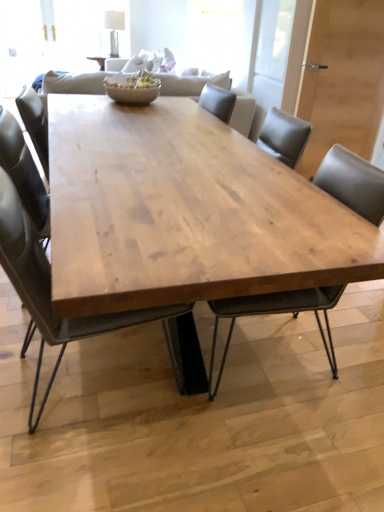
Locate an element on the screen. matte black chair at center, the first chair when ordered from left to right is located at coordinates (50, 289).

Locate an element on the screen. matte wood chair at center, which appears as the 2th chair when viewed from the left is located at coordinates (275, 313).

Considering the sizes of objects natural wood table at center and matte brown bowl at center in the image provided, who is taller, natural wood table at center or matte brown bowl at center?

natural wood table at center.

Considering the sizes of natural wood table at center and matte brown bowl at center in the image, is natural wood table at center bigger or smaller than matte brown bowl at center?

natural wood table at center is bigger than matte brown bowl at center.

Considering the positions of point (112, 113) and point (148, 98), is point (112, 113) closer or farther from the camera than point (148, 98)?

Clearly, point (112, 113) is closer to the camera than point (148, 98).

Choose the correct answer: Is natural wood table at center inside matte brown bowl at center or outside it?

The correct answer is: outside.

From the image's perspective, which is below, natural wood table at center or matte black chair at center, the first chair when ordered from left to right?

From the image's view, matte black chair at center, the first chair when ordered from left to right, is below.

Looking at this image, what's the angular difference between natural wood table at center and matte black chair at center, the second chair when ordered from right to left,'s facing directions?

The angle between the facing direction of natural wood table at center and the facing direction of matte black chair at center, the second chair when ordered from right to left, is 176 degrees.

Between natural wood table at center and matte black chair at center, the first chair when ordered from left to right, which one is positioned behind?

Positioned behind is matte black chair at center, the first chair when ordered from left to right.

Choose the correct answer: Is natural wood table at center inside matte black chair at center, the first chair when ordered from left to right, or outside it?

natural wood table at center is not inside matte black chair at center, the first chair when ordered from left to right, it's outside.

Does natural wood table at center touch matte wood chair at center, which appears as the 2th chair when viewed from the left?

No, natural wood table at center is not next to matte wood chair at center, which appears as the 2th chair when viewed from the left.

Looking at their sizes, would you say natural wood table at center is wider or thinner than matte wood chair at center, the 1th chair viewed from the right?

natural wood table at center is wider than matte wood chair at center, the 1th chair viewed from the right.

Does point (200, 296) appear closer or farther from the camera than point (295, 314)?

Point (200, 296).

Between matte wood chair at center, the 1th chair viewed from the right, and matte black chair at center, the first chair when ordered from left to right, which one appears on the right side from the viewer's perspective?

From the viewer's perspective, matte wood chair at center, the 1th chair viewed from the right, appears more on the right side.

In the scene shown: Would you consider matte wood chair at center, the 1th chair viewed from the right, to be distant from matte black chair at center, the second chair when ordered from right to left?

No, matte wood chair at center, the 1th chair viewed from the right, is in close proximity to matte black chair at center, the second chair when ordered from right to left.

Between point (332, 189) and point (55, 343), which one is positioned behind?

The point (332, 189) is more distant.

Considering the sizes of matte wood chair at center, the 1th chair viewed from the right, and matte black chair at center, the first chair when ordered from left to right, in the image, is matte wood chair at center, the 1th chair viewed from the right, wider or thinner than matte black chair at center, the first chair when ordered from left to right,?

Clearly, matte wood chair at center, the 1th chair viewed from the right, has more width compared to matte black chair at center, the first chair when ordered from left to right.

Is matte wood chair at center, which appears as the 2th chair when viewed from the left, oriented towards natural wood table at center?

Yes.

Which object is positioned more to the right, matte wood chair at center, which appears as the 2th chair when viewed from the left, or natural wood table at center?

matte wood chair at center, which appears as the 2th chair when viewed from the left.

Is matte wood chair at center, the 1th chair viewed from the right, thinner than natural wood table at center?

Yes.

Does matte wood chair at center, the 1th chair viewed from the right, touch natural wood table at center?

No, matte wood chair at center, the 1th chair viewed from the right, is not touching natural wood table at center.

From their relative heights in the image, would you say matte black chair at center, the first chair when ordered from left to right, is taller or shorter than matte brown bowl at center?

matte black chair at center, the first chair when ordered from left to right, is taller than matte brown bowl at center.

Is matte black chair at center, the second chair when ordered from right to left, at the right side of matte brown bowl at center?

Yes, matte black chair at center, the second chair when ordered from right to left, is to the right of matte brown bowl at center.

Does matte black chair at center, the first chair when ordered from left to right, have a greater width compared to matte brown bowl at center?

Indeed, matte black chair at center, the first chair when ordered from left to right, has a greater width compared to matte brown bowl at center.

Does point (51, 341) come in front of point (155, 82)?

Yes, it is in front of point (155, 82).

Can you confirm if matte black chair at center, the first chair when ordered from left to right, is shorter than matte wood chair at center, which appears as the 2th chair when viewed from the left?

Incorrect, the height of matte black chair at center, the first chair when ordered from left to right, does not fall short of that of matte wood chair at center, which appears as the 2th chair when viewed from the left.

Is matte black chair at center, the second chair when ordered from right to left, next to matte wood chair at center, which appears as the 2th chair when viewed from the left?

matte black chair at center, the second chair when ordered from right to left, and matte wood chair at center, which appears as the 2th chair when viewed from the left, are clearly separated.

Is matte black chair at center, the second chair when ordered from right to left, closer to camera compared to matte wood chair at center, which appears as the 2th chair when viewed from the left?

Yes, matte black chair at center, the second chair when ordered from right to left, is in front of matte wood chair at center, which appears as the 2th chair when viewed from the left.

Does matte black chair at center, the first chair when ordered from left to right, appear on the left side of matte wood chair at center, the 1th chair viewed from the right?

Correct, you'll find matte black chair at center, the first chair when ordered from left to right, to the left of matte wood chair at center, the 1th chair viewed from the right.

This screenshot has width=384, height=512. Identify the location of coffee table in front of the matte brown bowl at center. (185, 212).

What are the coordinates of `chair that is the 1st one when counting backward from the natural wood table at center` in the screenshot? It's located at (50, 289).

Based on their spatial positions, is matte brown bowl at center or natural wood table at center closer to matte wood chair at center, which appears as the 2th chair when viewed from the left?

Based on the image, natural wood table at center appears to be nearer to matte wood chair at center, which appears as the 2th chair when viewed from the left.

Considering their positions, is matte wood chair at center, the 1th chair viewed from the right, positioned further to matte black chair at center, the second chair when ordered from right to left, than matte brown bowl at center?

matte brown bowl at center.

Looking at this image, when comparing their distances from matte wood chair at center, which appears as the 2th chair when viewed from the left, does natural wood table at center or matte brown bowl at center seem closer?

natural wood table at center lies closer to matte wood chair at center, which appears as the 2th chair when viewed from the left, than the other object.

Estimate the real-world distances between objects in this image. Which object is further from matte wood chair at center, which appears as the 2th chair when viewed from the left, matte black chair at center, the first chair when ordered from left to right, or natural wood table at center?

natural wood table at center is positioned further to the anchor matte wood chair at center, which appears as the 2th chair when viewed from the left.

Based on their spatial positions, is matte brown bowl at center or natural wood table at center further from matte black chair at center, the first chair when ordered from left to right?

Among the two, matte brown bowl at center is located further to matte black chair at center, the first chair when ordered from left to right.

In the scene shown: From the image, which object appears to be nearer to matte black chair at center, the second chair when ordered from right to left, natural wood table at center or matte brown bowl at center?

Based on the image, natural wood table at center appears to be nearer to matte black chair at center, the second chair when ordered from right to left.

Estimate the real-world distances between objects in this image. Which object is closer to matte black chair at center, the second chair when ordered from right to left, natural wood table at center or matte wood chair at center, which appears as the 2th chair when viewed from the left?

matte wood chair at center, which appears as the 2th chair when viewed from the left, lies closer to matte black chair at center, the second chair when ordered from right to left, than the other object.

Looking at the image, which one is located further to matte brown bowl at center, natural wood table at center or matte wood chair at center, which appears as the 2th chair when viewed from the left?

matte wood chair at center, which appears as the 2th chair when viewed from the left, is further to matte brown bowl at center.

At what (x,y) coordinates should I click in order to perform the action: click on chair positioned between matte black chair at center, the second chair when ordered from right to left, and matte brown bowl at center from near to far. Please return your answer as a coordinate pair (x, y). Image resolution: width=384 pixels, height=512 pixels. Looking at the image, I should click on pyautogui.click(x=275, y=313).

This screenshot has height=512, width=384. What are the coordinates of `coffee table between matte black chair at center, the second chair when ordered from right to left, and matte wood chair at center, which appears as the 2th chair when viewed from the left` in the screenshot? It's located at (185, 212).